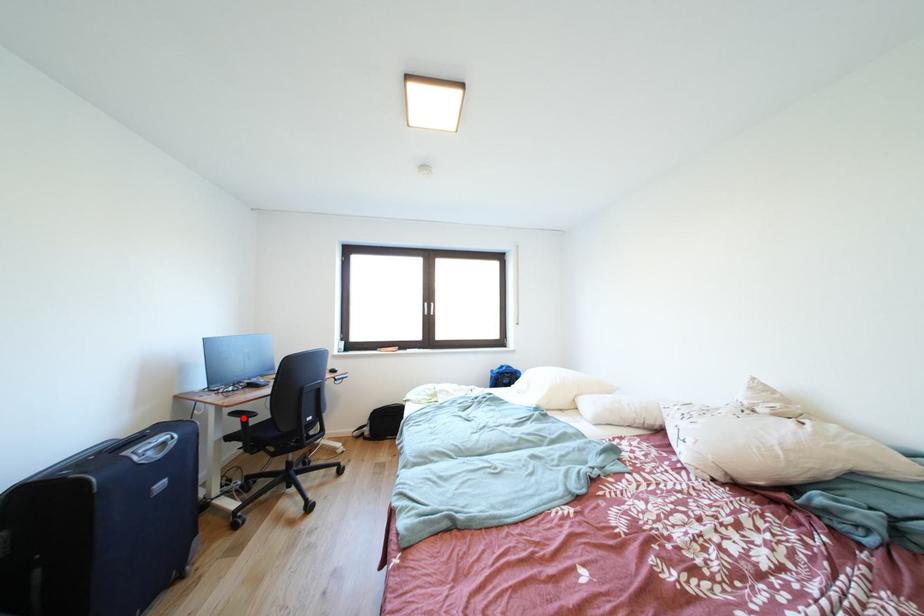
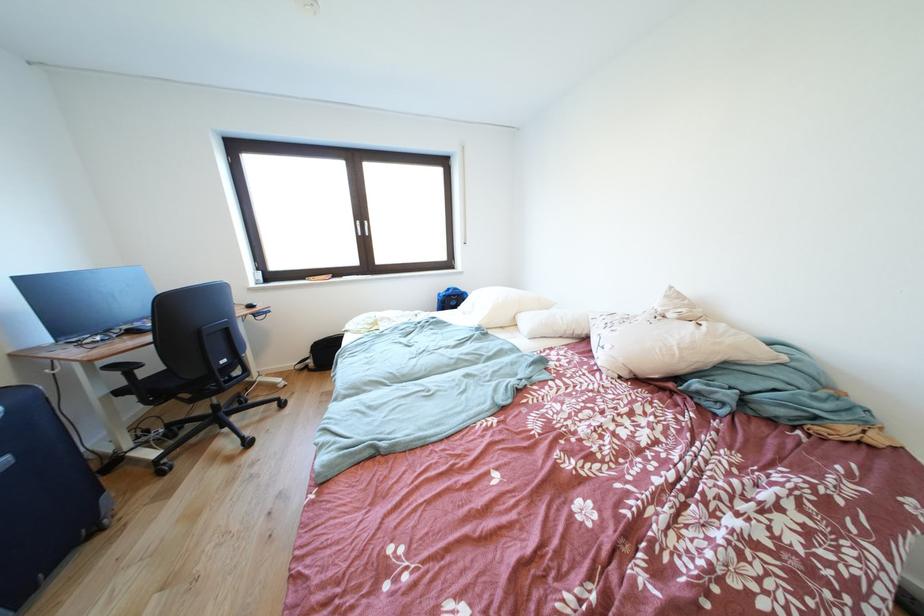
Question: I am providing you with two images of the same scene from different viewpoints. A red point is marked on the first image. Can you still see the location of the red point in image 2?

Choices:
 (A) Yes
 (B) No

Answer: (A)